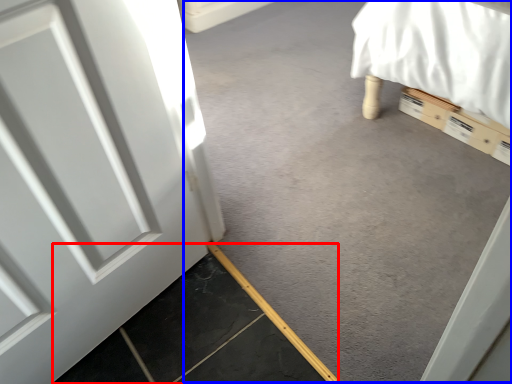
Question: Which point is closer to the camera, concrete (highlighted by a red box) or concrete (highlighted by a blue box)?

Choices:
 (A) concrete
 (B) concrete

Answer: (A)